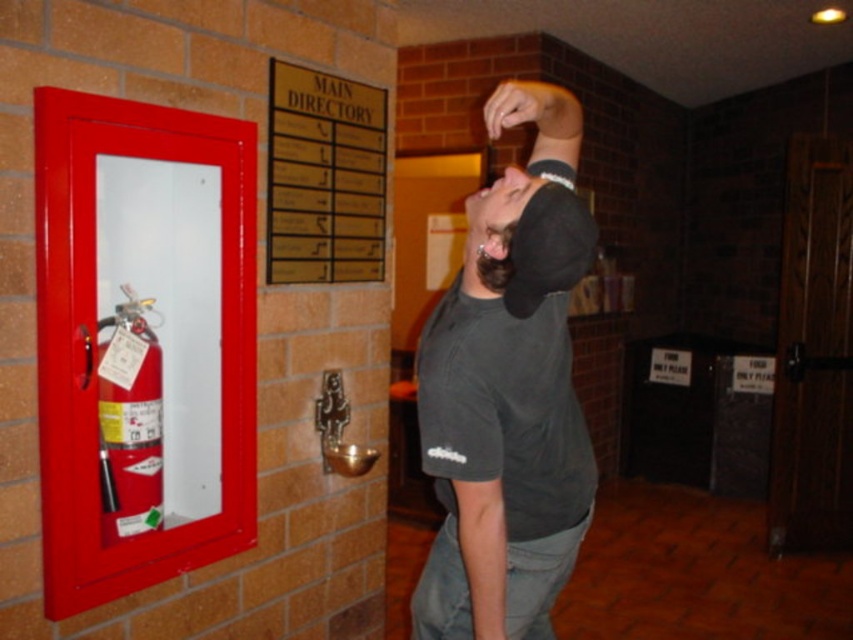
The height and width of the screenshot is (640, 853). What do you see at coordinates (508, 406) in the screenshot?
I see `dark gray cotton t-shirt at center` at bounding box center [508, 406].

Does dark gray cotton t-shirt at center appear under matte black hand at upper center?

Yes.

Identify the location of dark gray cotton t-shirt at center. The image size is (853, 640). (508, 406).

Does dark gray cotton t-shirt at center lie in front of gold metallic directory at upper center?

Yes.

Between dark gray cotton t-shirt at center and gold metallic directory at upper center, which one appears on the right side from the viewer's perspective?

dark gray cotton t-shirt at center

Who is more forward, [485,224] or [271,240]?

Point [485,224] is more forward.

Where is `dark gray cotton t-shirt at center`? The width and height of the screenshot is (853, 640). dark gray cotton t-shirt at center is located at coordinates (508, 406).

Is red matte fire extinguisher at left closer to camera compared to matte black hand at upper center?

No.

Is red matte fire extinguisher at left bigger than matte black hand at upper center?

Indeed, red matte fire extinguisher at left has a larger size compared to matte black hand at upper center.

Does point (155, 342) lie in front of point (498, 84)?

Yes, it is.

The height and width of the screenshot is (640, 853). Find the location of `red matte fire extinguisher at left`. red matte fire extinguisher at left is located at coordinates (129, 422).